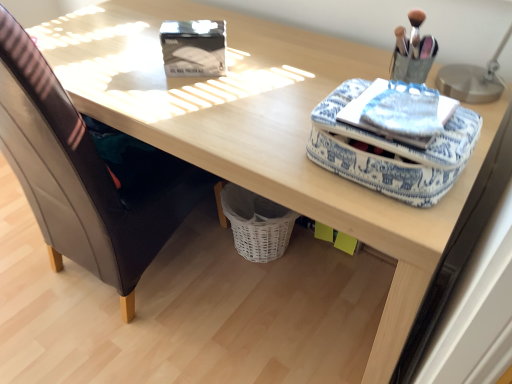
I want to click on free spot to the right of matte black storage box at upper center, so click(268, 71).